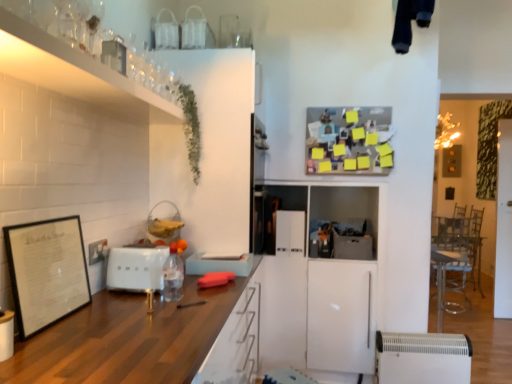
Measure the distance between clear plastic bottle at center and camera.

clear plastic bottle at center and camera are 5.72 feet apart.

This screenshot has width=512, height=384. What do you see at coordinates (127, 339) in the screenshot?
I see `wooden countertop at center, acting as the 2th cabinetry starting from the top` at bounding box center [127, 339].

What do you see at coordinates (352, 247) in the screenshot? The height and width of the screenshot is (384, 512). I see `gray matte cabinet at center, the second appliance ordered from the bottom` at bounding box center [352, 247].

Measure the distance between gray matte cabinet at center, the second appliance ordered from the bottom, and camera.

The depth of gray matte cabinet at center, the second appliance ordered from the bottom, is 2.88 meters.

The image size is (512, 384). What do you see at coordinates (190, 127) in the screenshot? I see `green leafy plant at upper left` at bounding box center [190, 127].

Identify the location of green leafy plant at upper left. Image resolution: width=512 pixels, height=384 pixels. (190, 127).

Describe the element at coordinates (290, 233) in the screenshot. Image resolution: width=512 pixels, height=384 pixels. I see `white glossy refrigerator at center, which appears as the 2th appliance when viewed from the left` at that location.

This screenshot has height=384, width=512. Identify the location of clear plastic bottle at center. (173, 276).

Is white plastic heater at lower right, which is the second appliance in front-to-back order, wider or thinner than white matte toaster at center, the second appliance viewed from the top?

white plastic heater at lower right, which is the second appliance in front-to-back order, is thinner than white matte toaster at center, the second appliance viewed from the top.

Between point (452, 359) and point (152, 279), which one is positioned in front?

Positioned in front is point (152, 279).

Measure the distance from white plastic heater at lower right, the 3th appliance in the back-to-front sequence, to white matte toaster at center, marked as the fourth appliance in a back-to-front arrangement.

1.83 meters.

From a real-world perspective, which object stands above the other?

white matte toaster at center, which ranks as the first appliance in left-to-right order, from a real-world perspective.

Is the position of gray matte cabinet at center, which is counted as the third appliance, starting from the top, more distant than that of wooden countertop at center, which ranks as the first cabinetry in bottom-to-top order?

Yes, gray matte cabinet at center, which is counted as the third appliance, starting from the top, is further from the viewer.

Which is correct: gray matte cabinet at center, the 3th appliance viewed from the front, is inside wooden countertop at center, which ranks as the first cabinetry in bottom-to-top order, or outside of it?

gray matte cabinet at center, the 3th appliance viewed from the front, is spatially situated outside wooden countertop at center, which ranks as the first cabinetry in bottom-to-top order.

From the image's perspective, is gray matte cabinet at center, placed as the second appliance when sorted from right to left, above or below wooden countertop at center, which ranks as the first cabinetry in bottom-to-top order?

gray matte cabinet at center, placed as the second appliance when sorted from right to left, is situated higher than wooden countertop at center, which ranks as the first cabinetry in bottom-to-top order, in the image.

Is white matte toaster at center, the fourth appliance positioned from the right, inside or outside of white glossy refrigerator at center, which appears as the 2th appliance when viewed from the left?

white matte toaster at center, the fourth appliance positioned from the right, is spatially situated outside white glossy refrigerator at center, which appears as the 2th appliance when viewed from the left.

Which object is wider, white matte toaster at center, the second appliance viewed from the top, or white glossy refrigerator at center, which appears as the fourth appliance when viewed from the front?

white matte toaster at center, the second appliance viewed from the top, is wider.

Is white matte toaster at center, marked as the fourth appliance in a back-to-front arrangement, facing away from white glossy refrigerator at center, which appears as the fourth appliance when viewed from the front?

white matte toaster at center, marked as the fourth appliance in a back-to-front arrangement, is not turned away from white glossy refrigerator at center, which appears as the fourth appliance when viewed from the front.

Looking at this image, which object is positioned more to the right, white matte toaster at center, the fourth appliance positioned from the right, or white glossy refrigerator at center, the 3th appliance in the right-to-left sequence?

Positioned to the right is white glossy refrigerator at center, the 3th appliance in the right-to-left sequence.

Starting from the clear plastic bottle at center, which appliance is the 1st one to the right? Please provide its 2D coordinates.

[(290, 233)]

Which is more to the left, clear plastic bottle at center or white glossy refrigerator at center, the first appliance in the top-to-bottom sequence?

Positioned to the left is clear plastic bottle at center.

Considering the sizes of objects clear plastic bottle at center and white glossy refrigerator at center, placed as the 4th appliance when sorted from bottom to top, in the image provided, who is thinner, clear plastic bottle at center or white glossy refrigerator at center, placed as the 4th appliance when sorted from bottom to top,?

Thinner between the two is white glossy refrigerator at center, placed as the 4th appliance when sorted from bottom to top.

Is white glossy refrigerator at center, which appears as the fourth appliance when viewed from the front, completely or partially inside clear plastic bottle at center?

That's incorrect, white glossy refrigerator at center, which appears as the fourth appliance when viewed from the front, is not inside clear plastic bottle at center.

Is clear glass shelf at upper left, which is counted as the 1th cabinetry, starting from the top, positioned far away from white glossy refrigerator at center, which appears as the 2th appliance when viewed from the left?

Yes, clear glass shelf at upper left, which is counted as the 1th cabinetry, starting from the top, and white glossy refrigerator at center, which appears as the 2th appliance when viewed from the left, are located far from each other.

Is point (86, 82) farther from camera compared to point (300, 229)?

No, it is not.

From a real-world perspective, is clear glass shelf at upper left, acting as the 2th cabinetry starting from the bottom, on white glossy refrigerator at center, placed as the 4th appliance when sorted from bottom to top?

Indeed, from a real-world perspective, clear glass shelf at upper left, acting as the 2th cabinetry starting from the bottom, stands above white glossy refrigerator at center, placed as the 4th appliance when sorted from bottom to top.

Is clear glass shelf at upper left, which is counted as the 1th cabinetry, starting from the top, outside of white glossy refrigerator at center, the 3th appliance in the right-to-left sequence?

Yes, clear glass shelf at upper left, which is counted as the 1th cabinetry, starting from the top, is located beyond the bounds of white glossy refrigerator at center, the 3th appliance in the right-to-left sequence.

Is the depth of white glossy refrigerator at center, acting as the 1th appliance starting from the back, greater than that of green leafy plant at upper left?

That is True.

Is white glossy refrigerator at center, acting as the 1th appliance starting from the back, at the right side of green leafy plant at upper left?

Yes.

In the scene shown: Who is taller, white glossy refrigerator at center, the first appliance in the top-to-bottom sequence, or green leafy plant at upper left?

green leafy plant at upper left.

From the image's perspective, count 1st appliances downward from the green leafy plant at upper left and point to it. Please provide its 2D coordinates.

[(290, 233)]

From a real-world perspective, is white plastic heater at lower right, acting as the first appliance starting from the bottom, located higher than white glossy refrigerator at center, the 3th appliance in the right-to-left sequence?

No, from a real-world perspective, white plastic heater at lower right, acting as the first appliance starting from the bottom, is not above white glossy refrigerator at center, the 3th appliance in the right-to-left sequence.

Considering the relative sizes of white plastic heater at lower right, the 3th appliance in the back-to-front sequence, and white glossy refrigerator at center, which appears as the fourth appliance when viewed from the front, in the image provided, is white plastic heater at lower right, the 3th appliance in the back-to-front sequence, wider than white glossy refrigerator at center, which appears as the fourth appliance when viewed from the front,?

Indeed, white plastic heater at lower right, the 3th appliance in the back-to-front sequence, has a greater width compared to white glossy refrigerator at center, which appears as the fourth appliance when viewed from the front.

You are a GUI agent. You are given a task and a screenshot of the screen. Output one action in this format:
    pyautogui.click(x=<x>, y=<y>)
    Task: Click on the 2nd appliance counting from the left side of the white plastic heater at lower right, the 3th appliance in the back-to-front sequence
    
    Given the screenshot: What is the action you would take?
    pyautogui.click(x=290, y=233)

Between white plastic heater at lower right, which is the second appliance in front-to-back order, and white glossy refrigerator at center, the 3th appliance in the right-to-left sequence, which one has less height?

white glossy refrigerator at center, the 3th appliance in the right-to-left sequence, is shorter.

You are a GUI agent. You are given a task and a screenshot of the screen. Output one action in this format:
    pyautogui.click(x=<x>, y=<y>)
    Task: Click on the 2nd appliance located beneath the white matte toaster at center, marked as the fourth appliance in a back-to-front arrangement (from a real-world perspective)
    This screenshot has height=384, width=512.
    Given the screenshot: What is the action you would take?
    pyautogui.click(x=423, y=358)

At what (x,y) coordinates should I click in order to perform the action: click on cabinetry lying below the gray matte cabinet at center, which appears as the second appliance when viewed from the back (from the image's perspective). Please return your answer as a coordinate pair (x, y). This screenshot has width=512, height=384. Looking at the image, I should click on (127, 339).

From the image, which object appears to be nearer to wooden countertop at center, acting as the 2th cabinetry starting from the top, white matte toaster at center, marked as the fourth appliance in a back-to-front arrangement, or gray matte cabinet at center, which is counted as the third appliance, starting from the top?

Among the two, white matte toaster at center, marked as the fourth appliance in a back-to-front arrangement, is located nearer to wooden countertop at center, acting as the 2th cabinetry starting from the top.

When comparing their distances from clear plastic bottle at center, does wooden countertop at center, which ranks as the first cabinetry in bottom-to-top order, or white matte toaster at center, the first appliance from the front, seem closer?

white matte toaster at center, the first appliance from the front.

Based on their spatial positions, is clear glass shelf at upper left, acting as the 2th cabinetry starting from the bottom, or wooden countertop at center, acting as the 2th cabinetry starting from the top, closer to white glossy refrigerator at center, placed as the 4th appliance when sorted from bottom to top?

Among the two, wooden countertop at center, acting as the 2th cabinetry starting from the top, is located nearer to white glossy refrigerator at center, placed as the 4th appliance when sorted from bottom to top.

From the picture: From the image, which object appears to be farther from white plastic heater at lower right, which is the fourth appliance from left to right, white matte toaster at center, the second appliance viewed from the top, or white glossy refrigerator at center, which appears as the fourth appliance when viewed from the front?

white matte toaster at center, the second appliance viewed from the top.

Looking at the image, which one is located closer to clear glass shelf at upper left, which is counted as the 1th cabinetry, starting from the top, black matte picture frame at left or white glossy refrigerator at center, which appears as the 2th appliance when viewed from the left?

black matte picture frame at left is positioned closer to the anchor clear glass shelf at upper left, which is counted as the 1th cabinetry, starting from the top.

Looking at the image, which one is located further to clear plastic bottle at center, black matte picture frame at left or clear glass shelf at upper left, acting as the 2th cabinetry starting from the bottom?

Among the two, clear glass shelf at upper left, acting as the 2th cabinetry starting from the bottom, is located further to clear plastic bottle at center.

Based on their spatial positions, is clear plastic bottle at center or black matte picture frame at left closer to white matte toaster at center, the second appliance viewed from the top?

clear plastic bottle at center is positioned closer to the anchor white matte toaster at center, the second appliance viewed from the top.

Estimate the real-world distances between objects in this image. Which object is closer to clear plastic bottle at center, white glossy refrigerator at center, which appears as the fourth appliance when viewed from the front, or wooden countertop at center, which ranks as the first cabinetry in bottom-to-top order?

The object closer to clear plastic bottle at center is wooden countertop at center, which ranks as the first cabinetry in bottom-to-top order.

Identify the location of appliance between black matte picture frame at left and green leafy plant at upper left from front to back. (136, 268).

Where is `picture frame between wooden countertop at center, which ranks as the first cabinetry in bottom-to-top order, and green leafy plant at upper left in the front-back direction`? This screenshot has width=512, height=384. picture frame between wooden countertop at center, which ranks as the first cabinetry in bottom-to-top order, and green leafy plant at upper left in the front-back direction is located at coordinates (46, 271).

You are a GUI agent. You are given a task and a screenshot of the screen. Output one action in this format:
    pyautogui.click(x=<x>, y=<y>)
    Task: Click on the plant situated between white matte toaster at center, marked as the fourth appliance in a back-to-front arrangement, and gray matte cabinet at center, placed as the second appliance when sorted from right to left, from left to right
    
    Given the screenshot: What is the action you would take?
    pyautogui.click(x=190, y=127)

Image resolution: width=512 pixels, height=384 pixels. I want to click on picture frame between clear glass shelf at upper left, acting as the 2th cabinetry starting from the bottom, and wooden countertop at center, which ranks as the first cabinetry in bottom-to-top order, in the vertical direction, so click(46, 271).